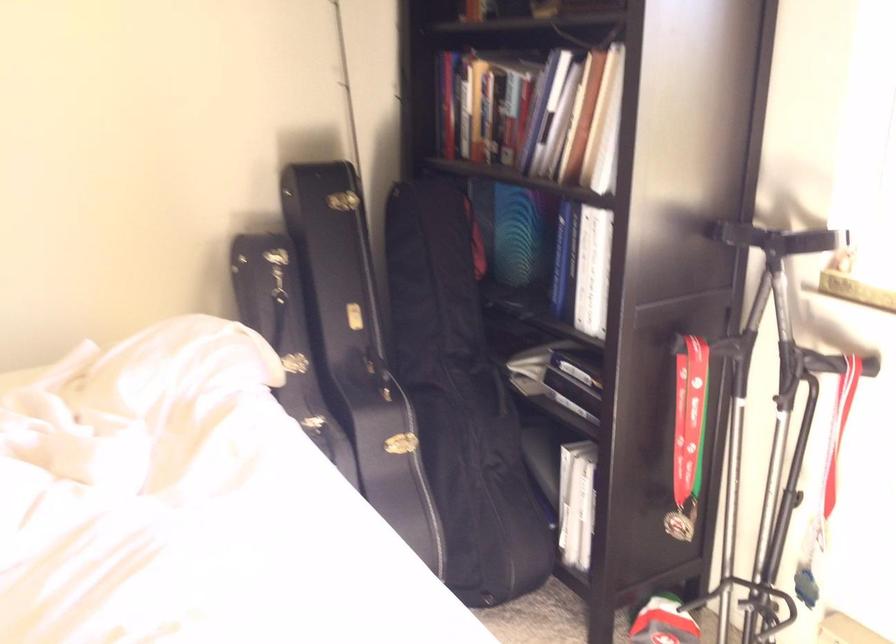
What are the coordinates of `gold case latch` in the screenshot? It's located at (343, 201).